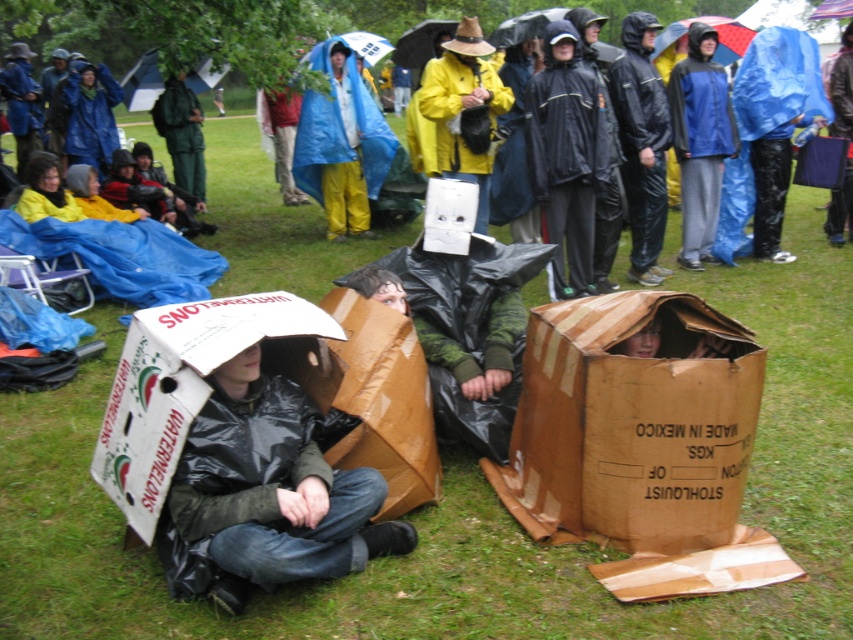
Is matte black jacket at center below yellow matte raincoat at center?

Yes, matte black jacket at center is below yellow matte raincoat at center.

Who is more distant from viewer, (318, 508) or (486, 156)?

Positioned behind is point (486, 156).

Locate an element on the screen. The height and width of the screenshot is (640, 853). matte black jacket at center is located at coordinates coord(265,493).

Who is lower down, blue matte raincoat at upper right or yellow matte raincoat at center?

Positioned lower is blue matte raincoat at upper right.

Find the location of a particular element. This screenshot has width=853, height=640. blue matte raincoat at upper right is located at coordinates (700, 141).

Can you confirm if blue tarpaulin at center is positioned below blue matte raincoat at upper right?

Incorrect, blue tarpaulin at center is not positioned below blue matte raincoat at upper right.

Is point (358, 106) farther from camera compared to point (688, 150)?

Yes.

Identify the location of blue tarpaulin at center. (341, 144).